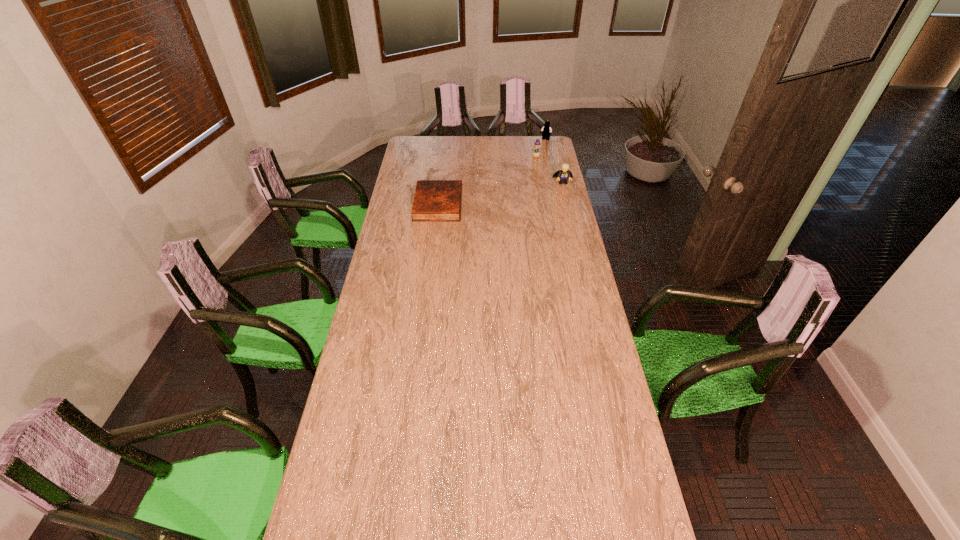
Where is `vacant space at the right edge of the desktop`? This screenshot has height=540, width=960. vacant space at the right edge of the desktop is located at coordinates (575, 261).

At what (x,y) coordinates should I click in order to perform the action: click on free space that is in between the nearer Lego and the farthest object. Please return your answer as a coordinate pair (x, y). Image resolution: width=960 pixels, height=540 pixels. Looking at the image, I should click on (554, 161).

This screenshot has width=960, height=540. I want to click on vacant area that lies between the nearer Lego and the second farthest object, so click(x=549, y=170).

Find the location of a particular element. The height and width of the screenshot is (540, 960). free space between the farthest object and the third object from right to left is located at coordinates (540, 149).

Find the location of a particular element. The height and width of the screenshot is (540, 960). vacant region between the shortest object and the duckling is located at coordinates (487, 181).

At what (x,y) coordinates should I click in order to perform the action: click on empty space between the second object from left to right and the nearer Lego. Please return your answer as a coordinate pair (x, y). This screenshot has width=960, height=540. Looking at the image, I should click on (549, 170).

Locate an element on the screen. The image size is (960, 540). unoccupied position between the duckling and the farther Lego is located at coordinates (540, 149).

Locate an element on the screen. Image resolution: width=960 pixels, height=540 pixels. empty location between the Bible and the farthest object is located at coordinates (492, 172).

I want to click on free point between the nearest object and the farther Lego, so click(492, 172).

What are the coordinates of `vacant area between the farther Lego and the leftmost object` in the screenshot? It's located at (492, 172).